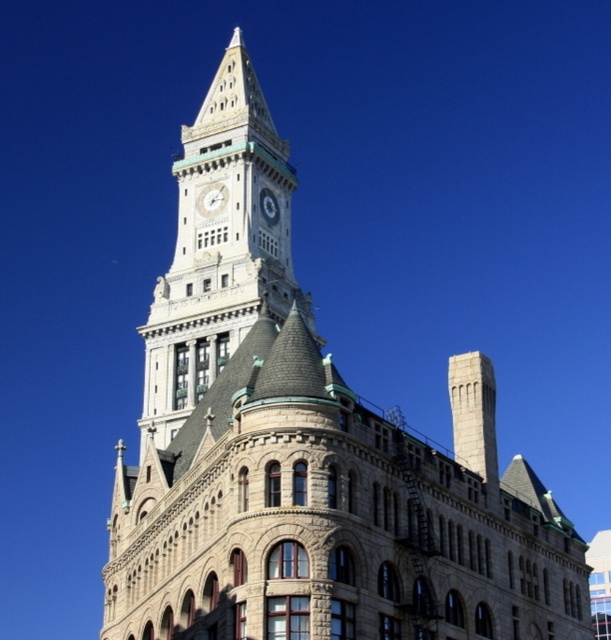
The width and height of the screenshot is (611, 640). In order to click on stone clock tower at center in this screenshot , I will do `click(218, 248)`.

Is stone clock tower at center below white glossy clock at upper center?

Yes, stone clock tower at center is below white glossy clock at upper center.

Does point (172, 289) come closer to viewer compared to point (213, 209)?

That is True.

At what (x,y) coordinates should I click in order to perform the action: click on stone clock tower at center. Please return your answer as a coordinate pair (x, y). Looking at the image, I should click on (218, 248).

Does white glossy clock at upper center lie behind silver metallic clock at center?

No, white glossy clock at upper center is closer to the viewer.

Can you confirm if white glossy clock at upper center is positioned to the right of silver metallic clock at center?

In fact, white glossy clock at upper center is to the left of silver metallic clock at center.

Who is more distant from viewer, (216,189) or (268,220)?

The point (268,220) is behind.

I want to click on white glossy clock at upper center, so click(x=211, y=198).

Who is positioned more to the left, stone clock tower at center or silver metallic clock at center?

stone clock tower at center is more to the left.

Can you confirm if stone clock tower at center is positioned above silver metallic clock at center?

No, stone clock tower at center is not above silver metallic clock at center.

This screenshot has width=611, height=640. Describe the element at coordinates (218, 248) in the screenshot. I see `stone clock tower at center` at that location.

What are the coordinates of `stone clock tower at center` in the screenshot? It's located at (218, 248).